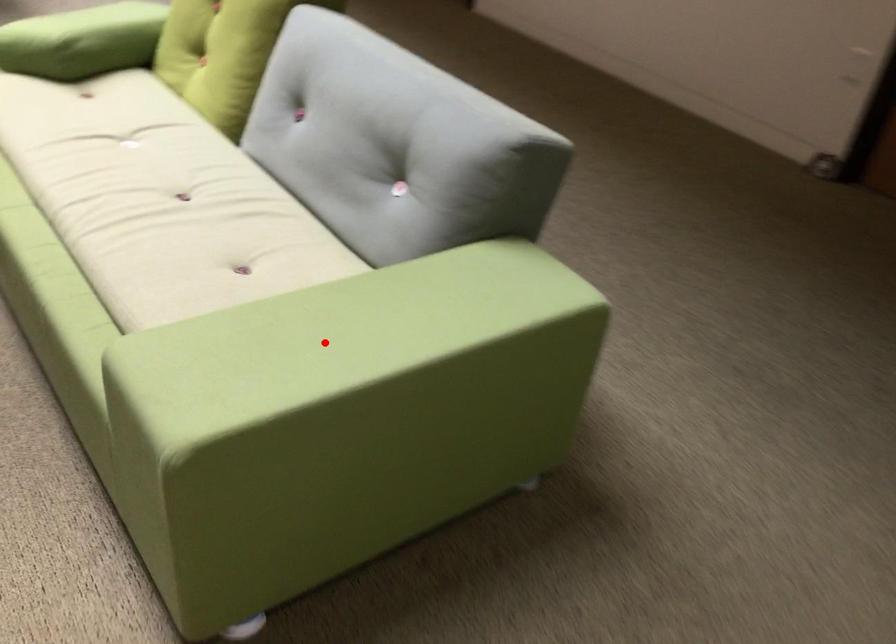
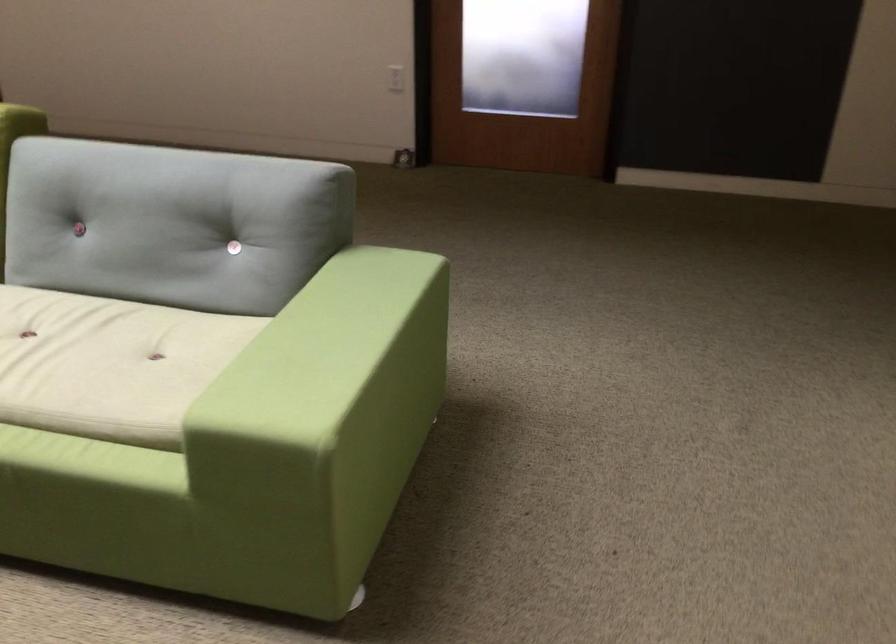
Question: I am providing you with two images of the same scene from different viewpoints. A red point is shown in image1. For the corresponding object point in image2, is it positioned nearer or farther from the camera?

Choices:
 (A) Nearer
 (B) Farther

Answer: (B)